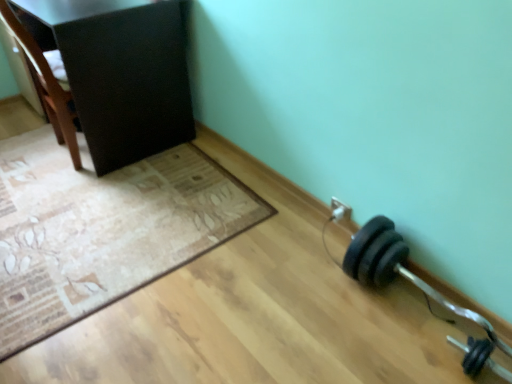
The height and width of the screenshot is (384, 512). I want to click on vacant location below black rubber dumbbell at lower right, which is the 1th dumbbell from top to bottom (from a real-world perspective), so click(417, 314).